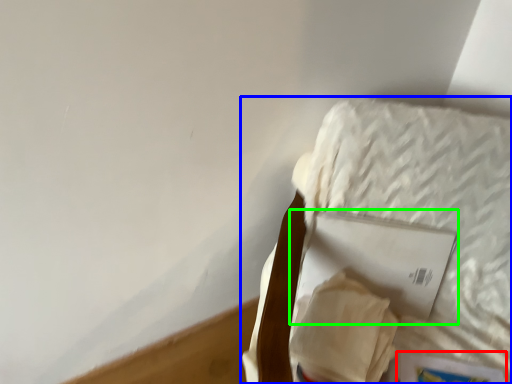
Question: Based on their relative distances, which object is nearer to paperback book (highlighted by a red box)? Choose from furniture (highlighted by a blue box) and paperback book (highlighted by a green box).

Choices:
 (A) furniture
 (B) paperback book

Answer: (B)